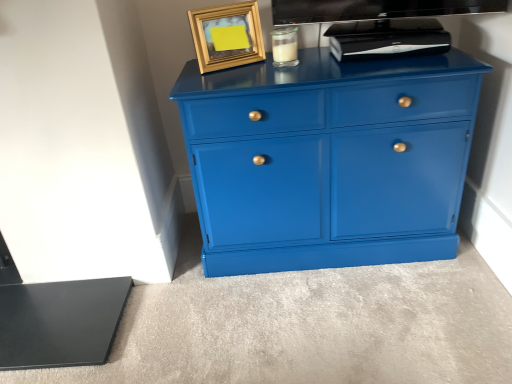
Question: From the image's perspective, is black plastic device at upper center above or below gold metallic picture frame at upper center?

Choices:
 (A) below
 (B) above

Answer: (A)

Question: From a real-world perspective, relative to gold metallic picture frame at upper center, is black plastic device at upper center vertically above or below?

Choices:
 (A) below
 (B) above

Answer: (A)

Question: Estimate the real-world distances between objects in this image. Which object is farther from the gold metallic picture frame at upper center?

Choices:
 (A) glossy blue cabinet at center
 (B) black plastic device at upper center
 (C) clear glass jar at upper center

Answer: (B)

Question: Estimate the real-world distances between objects in this image. Which object is farther from the gold metallic picture frame at upper center?

Choices:
 (A) glossy blue cabinet at center
 (B) black plastic device at upper center
 (C) clear glass jar at upper center

Answer: (B)